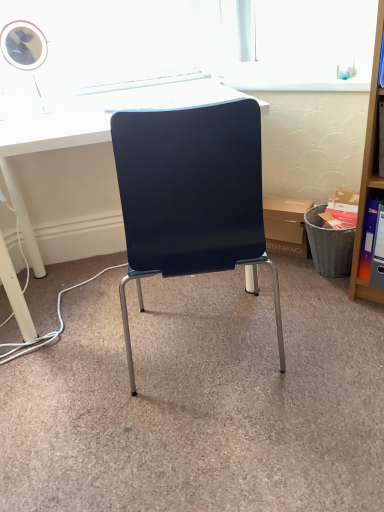
Question: Considering the relative sizes of matte cardboard box at center and white glossy desk at center in the image provided, is matte cardboard box at center wider than white glossy desk at center?

Choices:
 (A) no
 (B) yes

Answer: (A)

Question: Does matte cardboard box at center have a greater height compared to white glossy desk at center?

Choices:
 (A) no
 (B) yes

Answer: (A)

Question: Can you confirm if matte cardboard box at center is positioned to the right of white glossy desk at center?

Choices:
 (A) no
 (B) yes

Answer: (B)

Question: Is white glossy desk at center located within matte cardboard box at center?

Choices:
 (A) yes
 (B) no

Answer: (B)

Question: Is matte cardboard box at center positioned before white glossy desk at center?

Choices:
 (A) yes
 (B) no

Answer: (B)

Question: Relative to orange plastic ring binder at right, is wooden shelf at right in front or behind?

Choices:
 (A) front
 (B) behind

Answer: (A)

Question: From a real-world perspective, is wooden shelf at right positioned above or below orange plastic ring binder at right?

Choices:
 (A) above
 (B) below

Answer: (A)

Question: From their relative heights in the image, would you say wooden shelf at right is taller or shorter than orange plastic ring binder at right?

Choices:
 (A) short
 (B) tall

Answer: (B)

Question: Do you think wooden shelf at right is within orange plastic ring binder at right, or outside of it?

Choices:
 (A) inside
 (B) outside

Answer: (B)

Question: Is matte cardboard box at center inside or outside of white glossy desk at center?

Choices:
 (A) inside
 (B) outside

Answer: (B)

Question: Does point (286, 211) appear closer or farther from the camera than point (44, 121)?

Choices:
 (A) closer
 (B) farther

Answer: (B)

Question: Based on their sizes in the image, would you say matte cardboard box at center is bigger or smaller than white glossy desk at center?

Choices:
 (A) small
 (B) big

Answer: (A)

Question: Considering their positions, is matte cardboard box at center located in front of or behind white glossy desk at center?

Choices:
 (A) front
 (B) behind

Answer: (B)

Question: In the image, is orange plastic ring binder at right on the left side or the right side of white glossy desk at center?

Choices:
 (A) right
 (B) left

Answer: (A)

Question: Is orange plastic ring binder at right inside or outside of white glossy desk at center?

Choices:
 (A) outside
 (B) inside

Answer: (A)